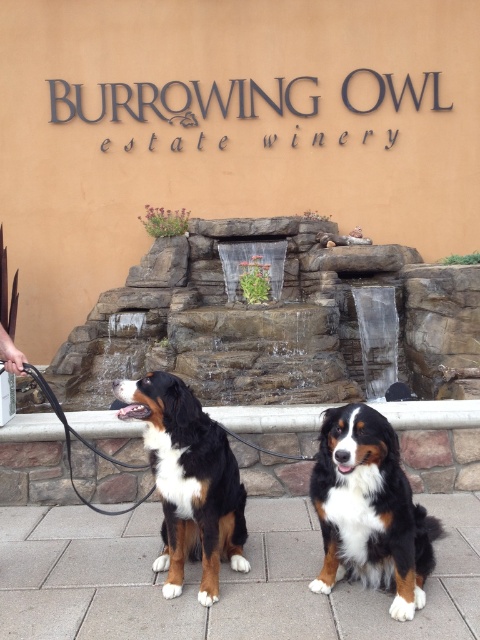
Is tri-colored fur dog at center wider than black rubber leash at left?

Correct, the width of tri-colored fur dog at center exceeds that of black rubber leash at left.

Find the location of `tri-colored fur dog at center`. tri-colored fur dog at center is located at coordinates (370, 509).

Which is in front, point (365, 532) or point (63, 417)?

Point (365, 532) is more forward.

Locate an element on the screen. This screenshot has width=480, height=640. tri-colored fur dog at center is located at coordinates (370, 509).

Which of these two, brown and white fur at center or black leather leash at left, stands taller?

Standing taller between the two is brown and white fur at center.

Who is more forward, (158, 467) or (140, 500)?

Point (158, 467) is more forward.

Where is `brown and white fur at center`? The width and height of the screenshot is (480, 640). brown and white fur at center is located at coordinates (189, 481).

You are a GUI agent. You are given a task and a screenshot of the screen. Output one action in this format:
    pyautogui.click(x=<x>, y=<y>)
    Task: Click on the brown and white fur at center
    The height and width of the screenshot is (640, 480).
    Given the screenshot: What is the action you would take?
    pyautogui.click(x=189, y=481)

Does tri-colored fur dog at center have a lesser height compared to black leather leash at left?

Yes.

Is point (352, 518) positioned after point (128, 467)?

No, (352, 518) is closer to viewer.

This screenshot has height=640, width=480. Find the location of `tri-colored fur dog at center`. tri-colored fur dog at center is located at coordinates (370, 509).